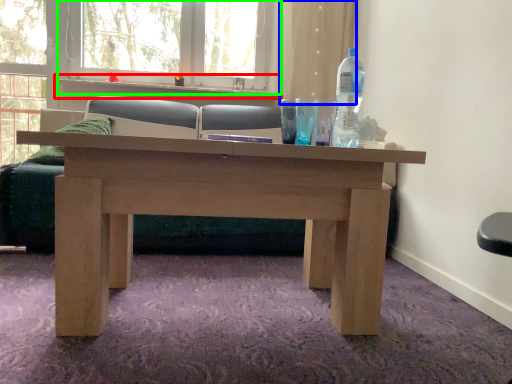
Question: Estimate the real-world distances between objects in this image. Which object is farther from window sill (highlighted by a red box), curtain (highlighted by a blue box) or window frame (highlighted by a green box)?

Choices:
 (A) curtain
 (B) window frame

Answer: (A)